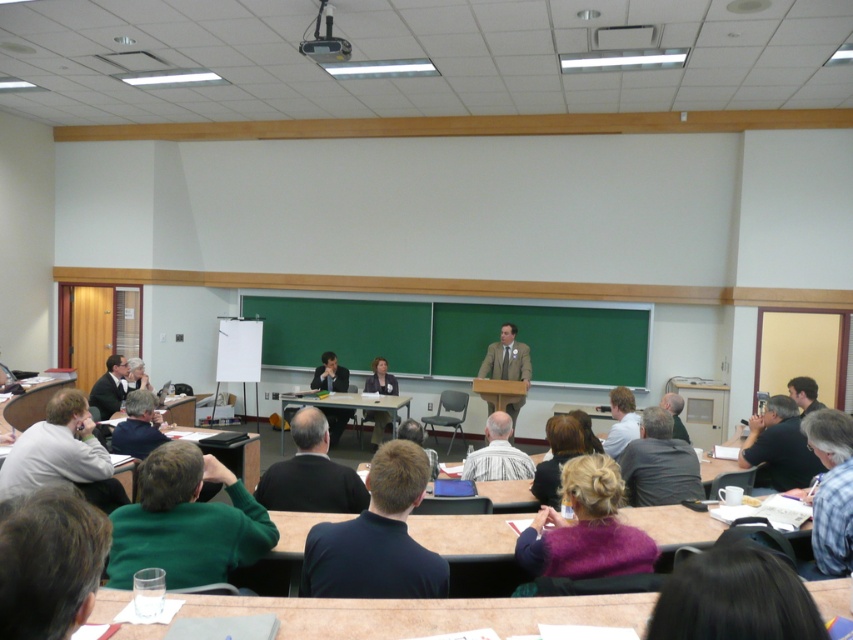
Does light gray shirt at lower left appear over gray striped shirt at center?

Yes, light gray shirt at lower left is above gray striped shirt at center.

Who is more distant from viewer, (57, 481) or (498, 458)?

Point (498, 458)

Find the location of `light gray shirt at lower left`. light gray shirt at lower left is located at coordinates (62, 454).

Who is more forward, [502,420] or [486,349]?

Point [502,420] is more forward.

Where is `gray striped shirt at center`? This screenshot has width=853, height=640. gray striped shirt at center is located at coordinates (497, 454).

How distant is light gray shirt at lower left from dark gray shirt at center?

3.87 meters

At what (x,y) coordinates should I click in order to perform the action: click on light gray shirt at lower left. Please return your answer as a coordinate pair (x, y). This screenshot has width=853, height=640. Looking at the image, I should click on (62, 454).

The height and width of the screenshot is (640, 853). What are the coordinates of `light gray shirt at lower left` in the screenshot? It's located at (x=62, y=454).